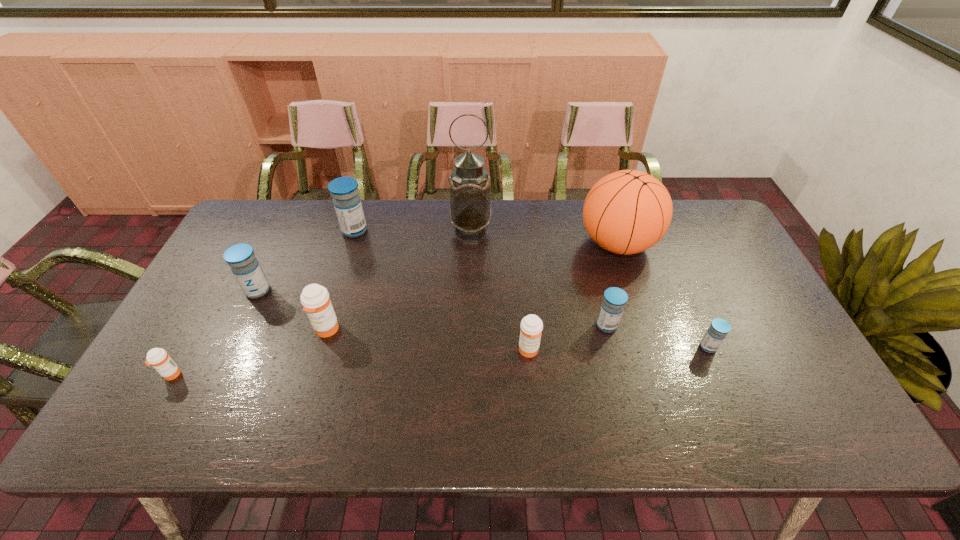
Image resolution: width=960 pixels, height=540 pixels. I want to click on orange medicine that is the closest one to the rightmost blue medicine, so click(x=531, y=325).

Identify which orange medicine is located as the third nearest to the second medicine from left to right. Please provide its 2D coordinates. Your answer should be formatted as a tuple, i.e. [(x, y)], where the tuple contains the x and y coordinates of a point satisfying the conditions above.

[(531, 325)]

The image size is (960, 540). I want to click on vacant point that satisfies the following two spatial constraints: 1. on the front side of the rightmost medicine; 2. on the right side of the third biggest blue medicine, so click(612, 347).

Where is `blank space that satisfies the following two spatial constraints: 1. on the back side of the nearest medicine; 2. on the right side of the second orange medicine from left to right`? blank space that satisfies the following two spatial constraints: 1. on the back side of the nearest medicine; 2. on the right side of the second orange medicine from left to right is located at coordinates (197, 329).

Find the location of a particular element. Image resolution: width=960 pixels, height=540 pixels. free spot that satisfies the following two spatial constraints: 1. on the back side of the third farthest blue medicine; 2. on the left side of the nearest orange medicine is located at coordinates (199, 325).